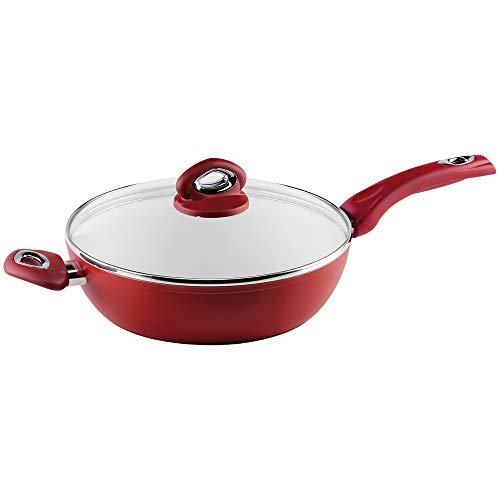
Locate an element on the screen. This screenshot has height=500, width=500. white inside of pan is located at coordinates (144, 249).